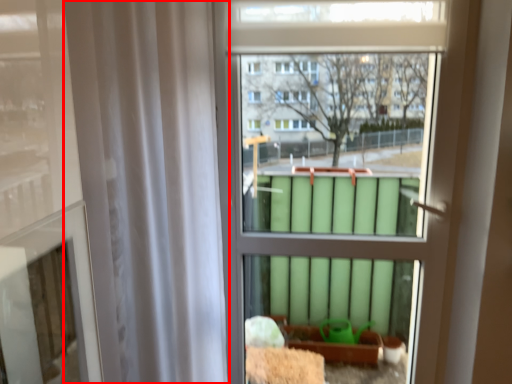
Question: Where is shower curtain (annotated by the red box) located in relation to bay window in the image?

Choices:
 (A) left
 (B) right

Answer: (A)